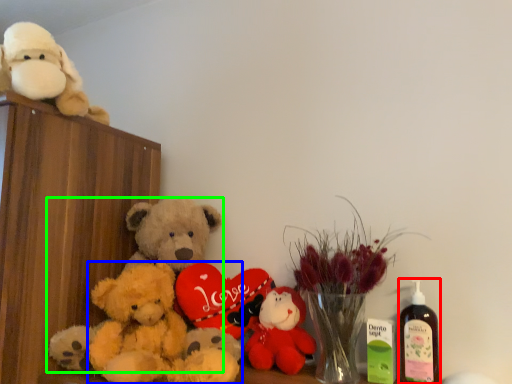
Question: Estimate the real-world distances between objects in this image. Which object is closer to bottle (highlighted by a red box), teddy bear (highlighted by a blue box) or teddy bear (highlighted by a green box)?

Choices:
 (A) teddy bear
 (B) teddy bear

Answer: (A)